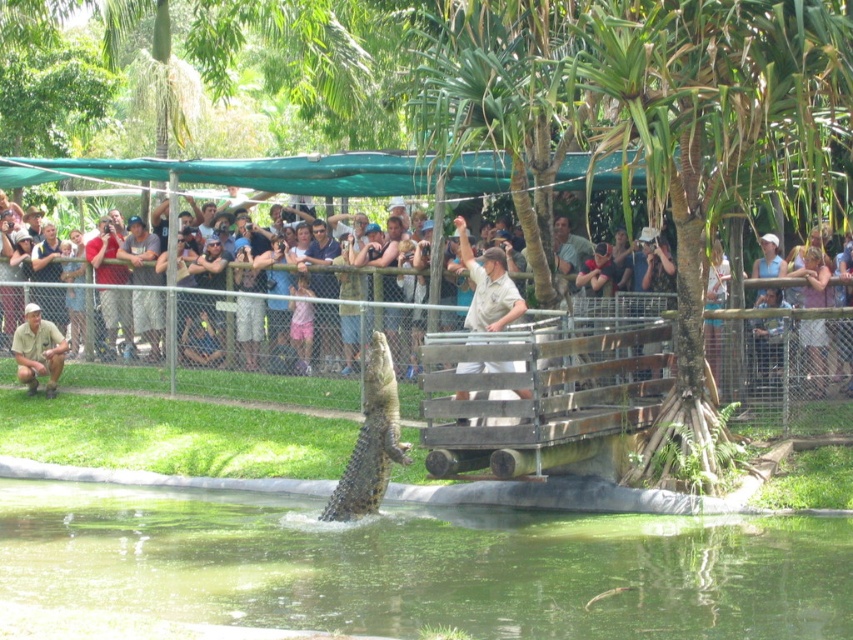
Is point (521, 632) closer to camera compared to point (45, 339)?

Yes, point (521, 632) is closer to viewer.

Can you confirm if greenish water at center is positioned below khaki uniform at lower left?

Correct, greenish water at center is located below khaki uniform at lower left.

Who is more distant from viewer, [628,563] or [32,392]?

Positioned behind is point [32,392].

I want to click on greenish water at center, so click(410, 568).

Who is taller, matte green fence at center or khaki uniform at center?

matte green fence at center

Can you confirm if matte green fence at center is positioned to the left of khaki uniform at center?

Correct, you'll find matte green fence at center to the left of khaki uniform at center.

Is point (9, 340) in front of point (473, 371)?

No, it is behind (473, 371).

Identify the location of matte green fence at center. (260, 317).

Is matte green fence at center below khaki uniform at lower left?

Actually, matte green fence at center is above khaki uniform at lower left.

Does matte green fence at center have a lesser width compared to khaki uniform at lower left?

No.

Image resolution: width=853 pixels, height=640 pixels. Identify the location of matte green fence at center. (260, 317).